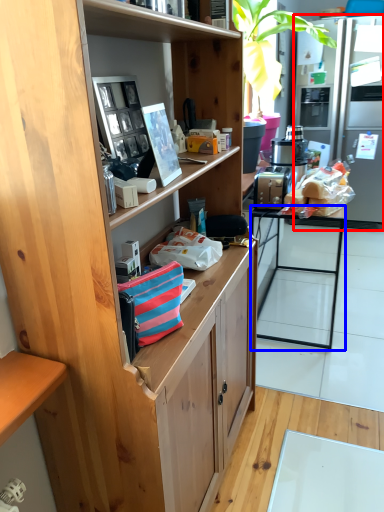
Question: Which point is closer to the camera, refrigerator (highlighted by a red box) or desk (highlighted by a blue box)?

Choices:
 (A) refrigerator
 (B) desk

Answer: (B)